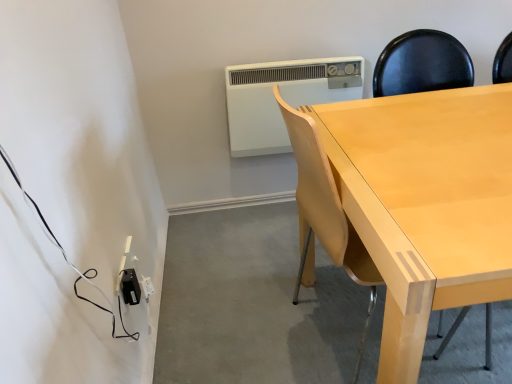
This screenshot has width=512, height=384. Identify the location of free space that is to the left of light wood chair at center. (241, 337).